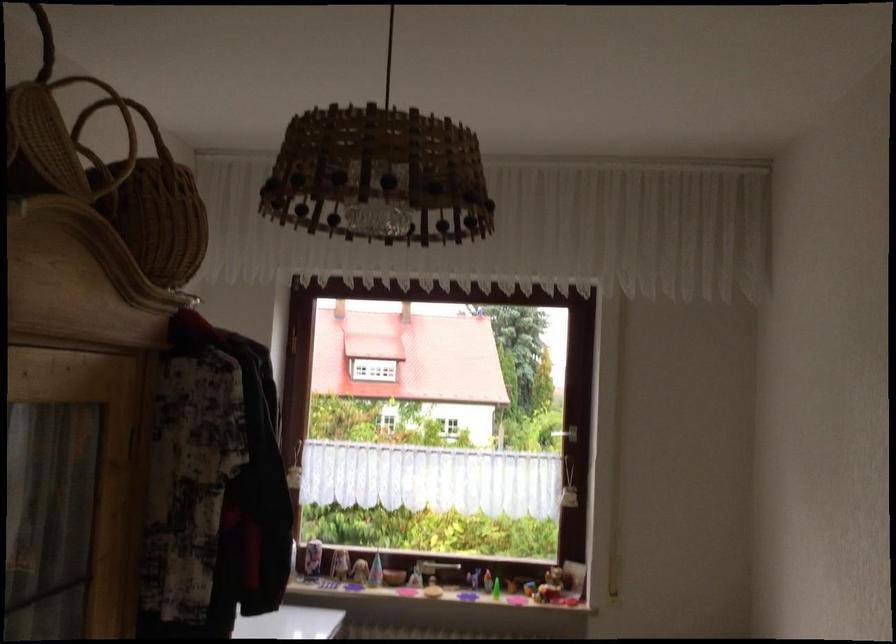
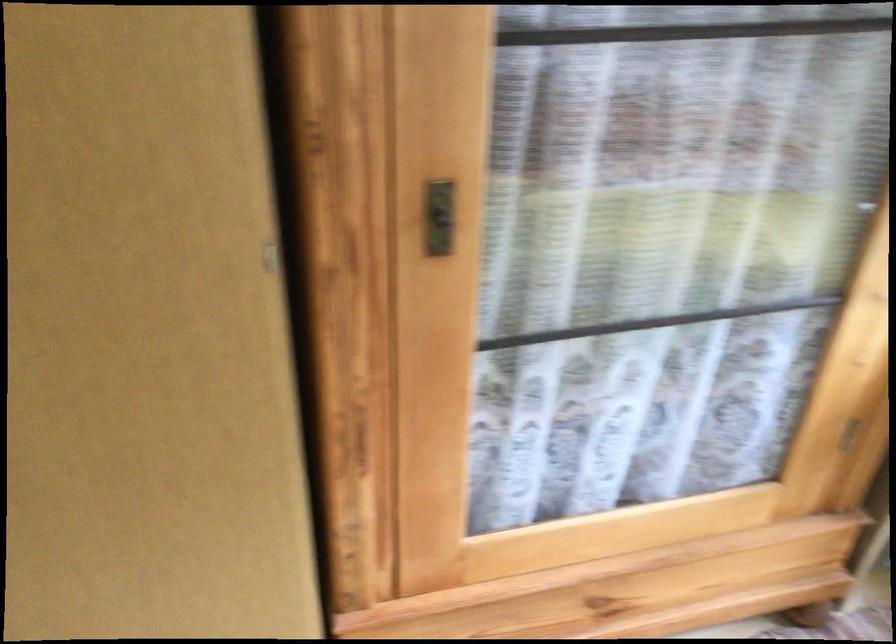
The images are taken continuously from a first-person perspective. In which direction is your viewpoint rotating?

The camera's rotation is toward left-down.